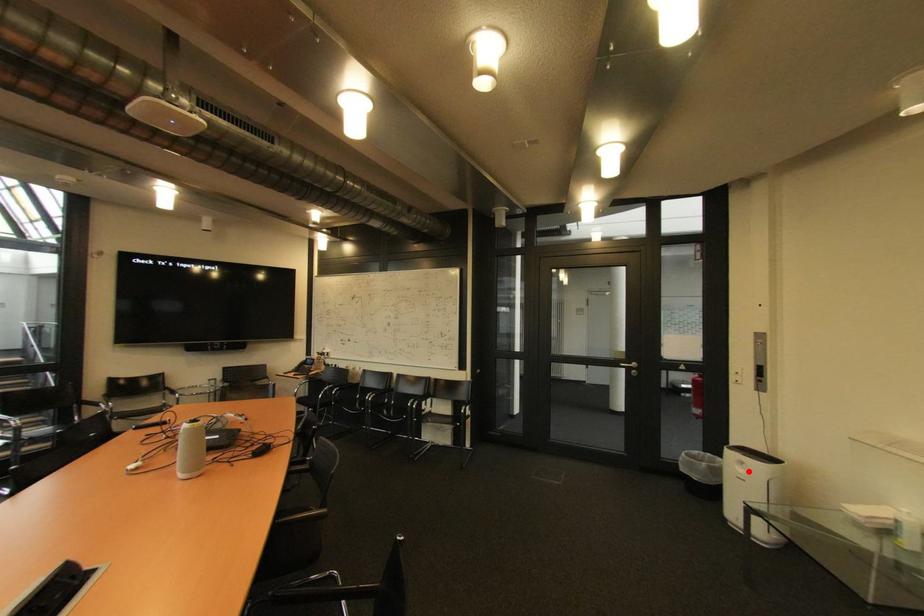
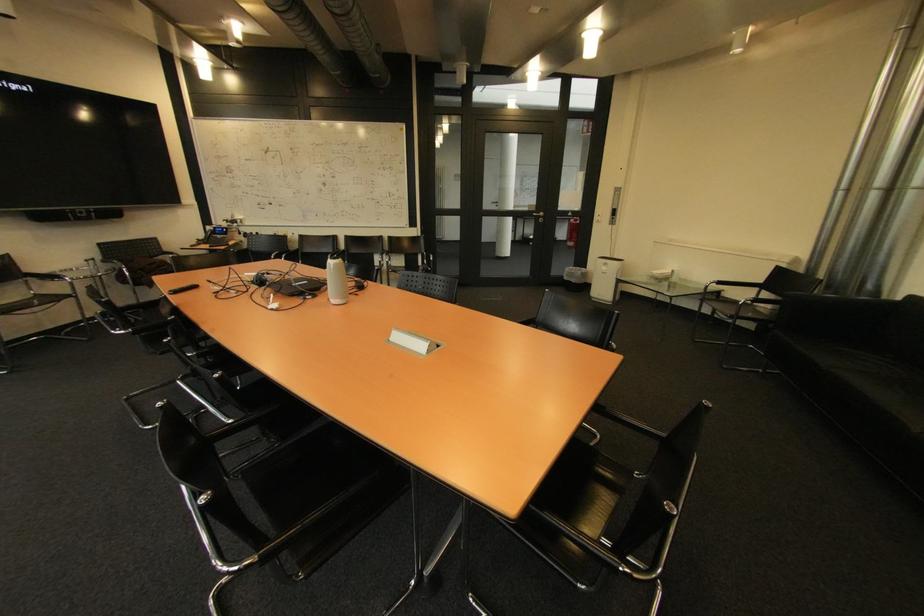
Question: I am providing you with two images of the same scene from different viewpoints. A red point is marked on the first image. At the location where the point appears in image 1, is it still visible in image 2?

Choices:
 (A) Yes
 (B) No

Answer: (A)